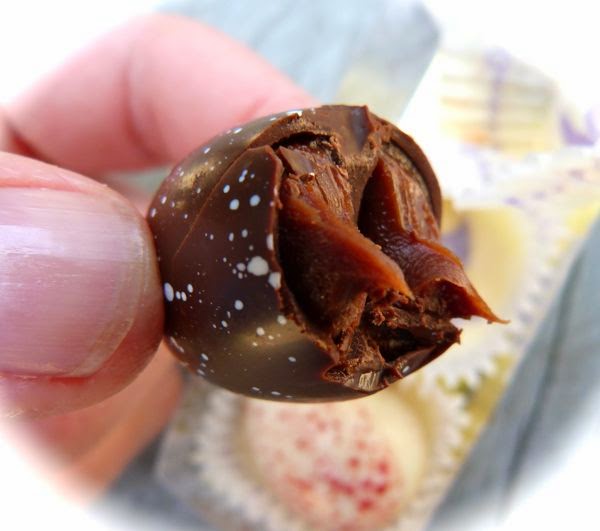
In order to click on sheet in this screenshot , I will do `click(228, 479)`.